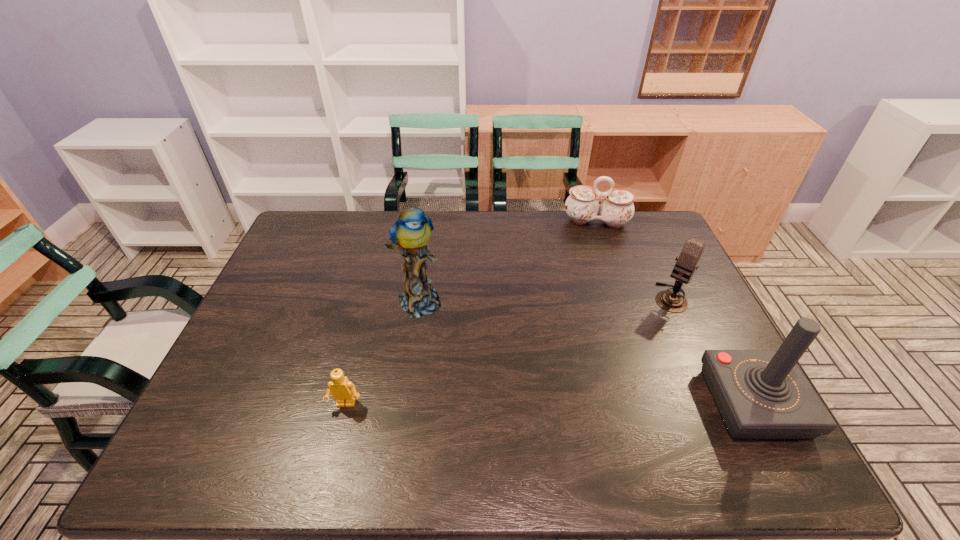
Find the location of `Lego`. Lego is located at coordinates (343, 391).

Find the location of a particular element. the leftmost object is located at coordinates (343, 391).

Where is `joystick`? The width and height of the screenshot is (960, 540). joystick is located at coordinates (761, 394).

Where is `the third shortest object`? the third shortest object is located at coordinates (672, 301).

This screenshot has width=960, height=540. In order to click on the second shortest object in this screenshot , I will do `click(582, 206)`.

The width and height of the screenshot is (960, 540). In order to click on chinaware in this screenshot , I will do `click(582, 206)`.

Locate an element on the screen. The image size is (960, 540). the tallest object is located at coordinates (410, 234).

Where is `parrot`? parrot is located at coordinates (410, 234).

Find the location of a particular element. The height and width of the screenshot is (540, 960). vacant area situated 0.220m on the front-facing side of the third shortest object is located at coordinates (630, 355).

The width and height of the screenshot is (960, 540). Find the location of `free region located 0.120m on the front-facing side of the third shortest object`. free region located 0.120m on the front-facing side of the third shortest object is located at coordinates (646, 333).